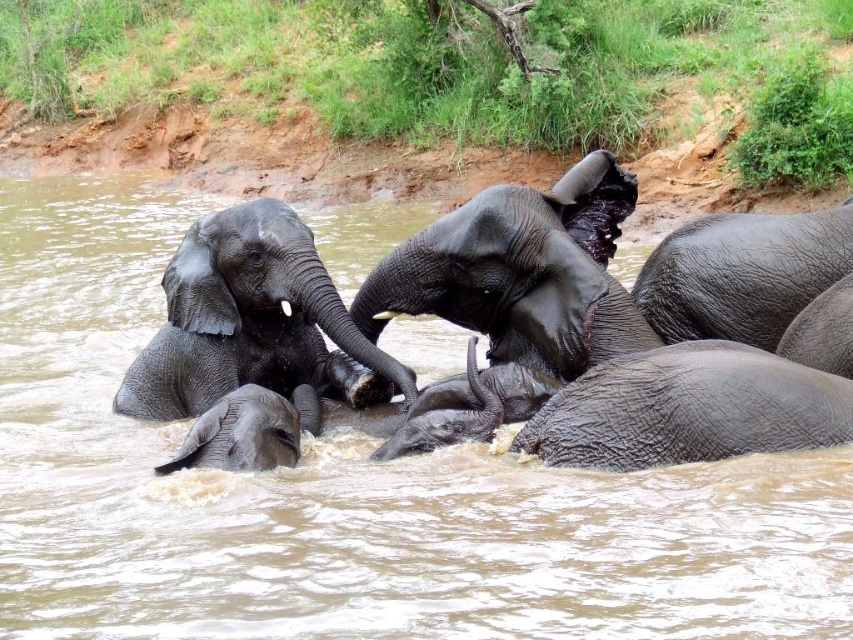
Does point (537, 214) lie in front of point (390, 445)?

No.

Is point (357, 308) in front of point (480, 400)?

No, it is not.

This screenshot has height=640, width=853. I want to click on shiny dark gray elephant at center, so click(521, 272).

Which is more to the right, shiny dark gray elephant at center or wet gray elephant at lower right?

shiny dark gray elephant at center is more to the right.

Is point (467, 301) positioned in front of point (558, 406)?

No.

Where is `shiny dark gray elephant at center`? shiny dark gray elephant at center is located at coordinates (521, 272).

Locate an element on the screen. This screenshot has width=853, height=640. shiny dark gray elephant at center is located at coordinates (521, 272).

Is the position of brown muddy water at center less distant than that of dark gray textured elephant at center?

Yes, brown muddy water at center is in front of dark gray textured elephant at center.

Which is above, brown muddy water at center or dark gray textured elephant at center?

brown muddy water at center

Find the location of a particular element. This screenshot has width=853, height=640. brown muddy water at center is located at coordinates (347, 493).